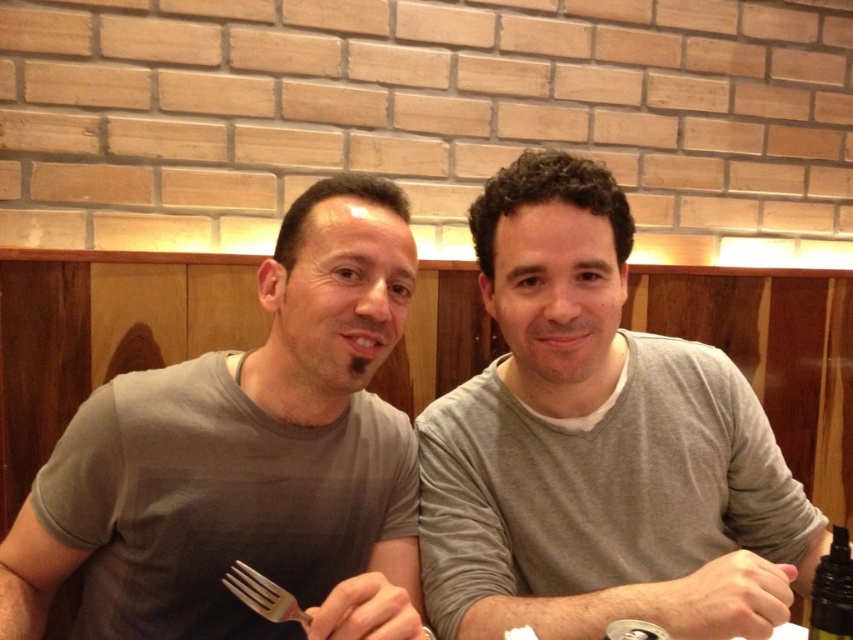
You are a delivery robot that needs to place a small package on the table in the image. The target location for the package is at point (244,529). Your robotic arm can reach up to 80 centimeters. Can you safely place the package at the specified point without extending beyond your reach?

The distance of point (244,529) from the camera is 90.16 centimeters. Since the robotic arm can only reach up to 80 centimeters, the package cannot be placed at that point without exceeding the arm reach.

You are a photographer setting up a shot of the scene. You need to ensure that the gray cotton shirt at center is visible above the silver metallic fork at lower center. Is this already the case in the current setup?

Yes, the gray cotton shirt at center is already positioned above the silver metallic fork at lower center in the current setup.